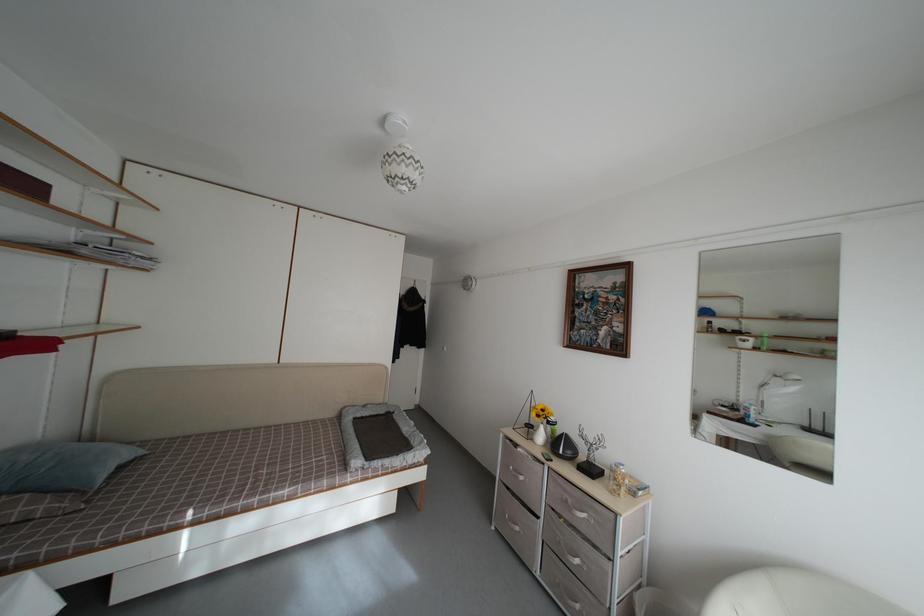
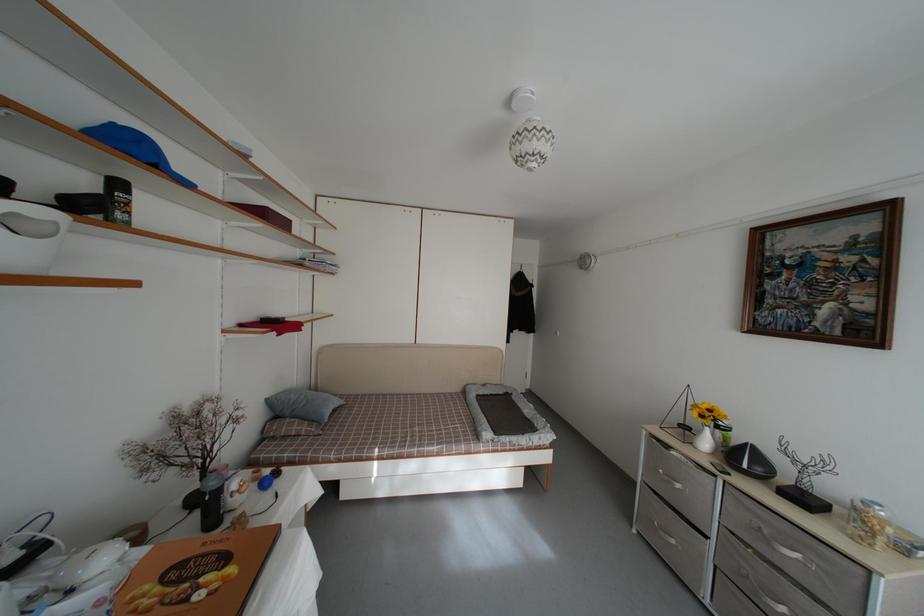
In the second image, find the point that corresponds to point (558, 438) in the first image.

(731, 446)